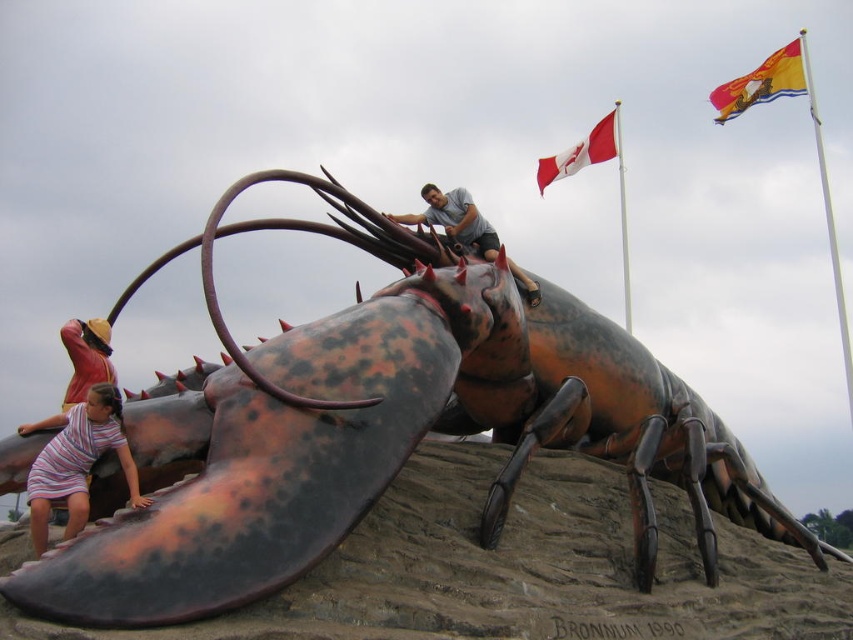
You are standing at the origin point of the coordinate system in the image. The Canadian flag is at position 0.5,0.5 and the provincial flag is at 0.7,0.6. Can you determine which flag is closer to the rustic metal lobster at center?

The Canadian flag at position (426,320) is closer to the rustic metal lobster at center since the distance between them is sqrt of squared differences between 0.672 and 0.5 plus 0.450 and 0.5, which is sqrt of 0.045 and 0.0225, totaling sqrt of 0.0675, which is approximately 0.26. The distance to the provincial flag at (511,448) would be sqrt of 0.0064 and 0.0225, totaling sqrt of 0.0289, which is 0.17. Wait, actually, let me recalculate. Wait, the coordinates for the lobster are (383,429). The Canadian flag

You are an artist planning to paint a scene based on the image. You need to ensure the proportions between the rustic metal lobster at center and the matte gray shirt at upper center are accurate. Which object should you make wider in your painting?

The rustic metal lobster at center should be made wider in the painting since it is larger in width than the matte gray shirt at upper center according to the description.